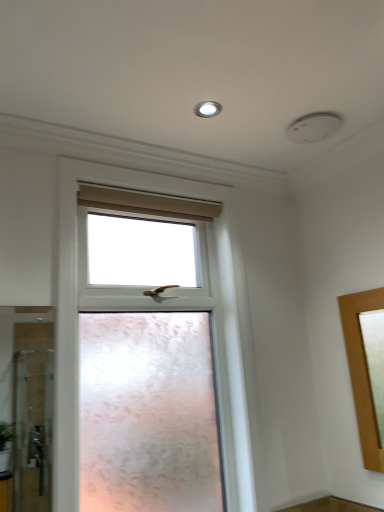
Question: Does clear glass window at center have a greater height compared to white glossy light fixture at upper center?

Choices:
 (A) yes
 (B) no

Answer: (A)

Question: From a real-world perspective, is clear glass window at center located beneath white glossy light fixture at upper center?

Choices:
 (A) no
 (B) yes

Answer: (B)

Question: Considering the relative positions of clear glass window at center and white glossy light fixture at upper center in the image provided, is clear glass window at center to the right of white glossy light fixture at upper center from the viewer's perspective?

Choices:
 (A) no
 (B) yes

Answer: (A)

Question: Can you confirm if clear glass window at center is bigger than white glossy light fixture at upper center?

Choices:
 (A) yes
 (B) no

Answer: (A)

Question: Would you consider clear glass window at center to be distant from white glossy light fixture at upper center?

Choices:
 (A) no
 (B) yes

Answer: (A)

Question: From the image's perspective, does clear glass window at center appear higher than white glossy light fixture at upper center?

Choices:
 (A) no
 (B) yes

Answer: (A)

Question: Does white glossy light fixture at upper center have a larger size compared to clear glass window at center?

Choices:
 (A) no
 (B) yes

Answer: (A)

Question: Can clear glass window at center be found inside white glossy light fixture at upper center?

Choices:
 (A) no
 (B) yes

Answer: (A)

Question: Is white glossy light fixture at upper center positioned in front of clear glass window at center?

Choices:
 (A) no
 (B) yes

Answer: (A)

Question: Considering the relative sizes of white glossy light fixture at upper center and clear glass window at center in the image provided, is white glossy light fixture at upper center shorter than clear glass window at center?

Choices:
 (A) no
 (B) yes

Answer: (B)

Question: From a real-world perspective, does white glossy light fixture at upper center stand above clear glass window at center?

Choices:
 (A) yes
 (B) no

Answer: (A)

Question: Is white glossy light fixture at upper center not inside clear glass window at center?

Choices:
 (A) yes
 (B) no

Answer: (A)

Question: Looking at the image, does white glossy light fixture at upper center seem bigger or smaller compared to clear glass window at center?

Choices:
 (A) big
 (B) small

Answer: (B)